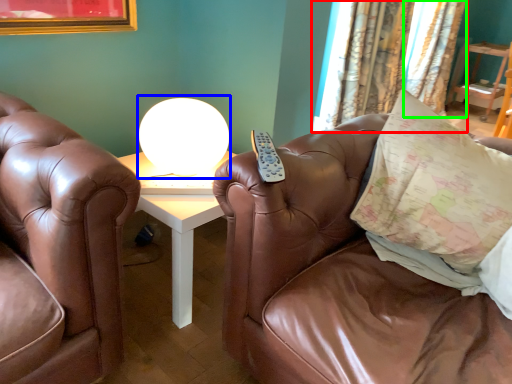
Question: Which object is the closest to the curtain (highlighted by a red box)? Choose among these: table lamp (highlighted by a blue box) or curtain (highlighted by a green box).

Choices:
 (A) table lamp
 (B) curtain

Answer: (B)